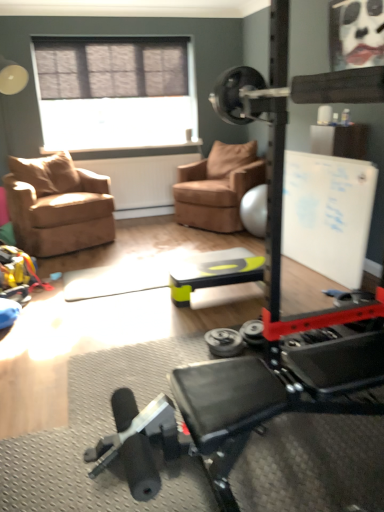
Where is `green plastic table at center`? The height and width of the screenshot is (512, 384). green plastic table at center is located at coordinates (214, 272).

This screenshot has height=512, width=384. Find the location of `white matte bulletin board at upper right`. white matte bulletin board at upper right is located at coordinates (328, 214).

Image resolution: width=384 pixels, height=512 pixels. What do you see at coordinates (361, 32) in the screenshot? I see `matte black face at upper right` at bounding box center [361, 32].

In order to face suede brown armchair at left, which appears as the second chair when viewed from the right, should I rotate leftwards or rightwards?

Turn left approximately 17.160 degrees to face it.

The height and width of the screenshot is (512, 384). I want to click on suede brown armchair at center, the first chair positioned from the right, so click(217, 187).

From the image's perspective, is matte gray window at upper center below green plastic table at center?

No.

Considering the sizes of matte gray window at upper center and green plastic table at center in the image, is matte gray window at upper center bigger or smaller than green plastic table at center?

In the image, matte gray window at upper center appears to be larger than green plastic table at center.

From a real-world perspective, is matte gray window at upper center below green plastic table at center?

No, from a real-world perspective, matte gray window at upper center is not below green plastic table at center.

Which object is thinner, matte black face at upper right or suede brown armchair at center, which is counted as the 2th chair, starting from the left?

matte black face at upper right is thinner.

From their relative heights in the image, would you say matte black face at upper right is taller or shorter than suede brown armchair at center, which is counted as the 2th chair, starting from the left?

In the image, matte black face at upper right appears to be shorter than suede brown armchair at center, which is counted as the 2th chair, starting from the left.

Between matte black face at upper right and suede brown armchair at center, the first chair positioned from the right, which one has larger size?

With larger size is suede brown armchair at center, the first chair positioned from the right.

From a real-world perspective, relative to white matte bulletin board at upper right, is suede brown armchair at left, placed as the 1th chair when sorted from left to right, vertically above or below?

suede brown armchair at left, placed as the 1th chair when sorted from left to right, is below white matte bulletin board at upper right.

Is suede brown armchair at left, placed as the 1th chair when sorted from left to right, smaller than white matte bulletin board at upper right?

No.

Choose the correct answer: Is suede brown armchair at left, placed as the 1th chair when sorted from left to right, inside white matte bulletin board at upper right or outside it?

The correct answer is: outside.

Is suede brown armchair at left, placed as the 1th chair when sorted from left to right, facing away from silver metallic dumbbell at center?

No, suede brown armchair at left, placed as the 1th chair when sorted from left to right, is not facing the opposite direction of silver metallic dumbbell at center.

From the picture: How much distance is there between suede brown armchair at left, which appears as the second chair when viewed from the right, and silver metallic dumbbell at center?

A distance of 7.71 feet exists between suede brown armchair at left, which appears as the second chair when viewed from the right, and silver metallic dumbbell at center.

Does suede brown armchair at left, placed as the 1th chair when sorted from left to right, touch silver metallic dumbbell at center?

No, suede brown armchair at left, placed as the 1th chair when sorted from left to right, is not making contact with silver metallic dumbbell at center.

Considering the relative sizes of suede brown armchair at left, placed as the 1th chair when sorted from left to right, and silver metallic dumbbell at center in the image provided, is suede brown armchair at left, placed as the 1th chair when sorted from left to right, taller than silver metallic dumbbell at center?

Indeed, suede brown armchair at left, placed as the 1th chair when sorted from left to right, has a greater height compared to silver metallic dumbbell at center.

Is point (366, 163) farther from viewer compared to point (83, 53)?

No.

Would you say matte gray window at upper center is part of white matte bulletin board at upper right's contents?

Definitely not — matte gray window at upper center is not inside white matte bulletin board at upper right.

Which object is thinner, white matte bulletin board at upper right or matte gray window at upper center?

matte gray window at upper center is thinner.

Would you consider white matte bulletin board at upper right to be distant from matte gray window at upper center?

Absolutely, white matte bulletin board at upper right is distant from matte gray window at upper center.

Which is farther from the camera, (57, 50) or (220, 335)?

Point (57, 50)

Is matte gray window at upper center oriented towards silver metallic dumbbell at center?

Yes, matte gray window at upper center faces towards silver metallic dumbbell at center.

Can silver metallic dumbbell at center be found inside matte gray window at upper center?

Actually, silver metallic dumbbell at center is outside matte gray window at upper center.

Is matte gray window at upper center not near silver metallic dumbbell at center?

Absolutely, matte gray window at upper center is distant from silver metallic dumbbell at center.

Does silver metallic dumbbell at center have a greater height compared to suede brown armchair at left, placed as the 1th chair when sorted from left to right?

No.

Find the location of a particular element. dumbbell lying below the suede brown armchair at left, which appears as the second chair when viewed from the right (from the image's perspective) is located at coordinates (224, 342).

Could you tell me if silver metallic dumbbell at center is turned towards suede brown armchair at left, which appears as the second chair when viewed from the right?

No, silver metallic dumbbell at center is not aimed at suede brown armchair at left, which appears as the second chair when viewed from the right.

Is point (229, 333) farther from viewer compared to point (61, 226)?

No, it is not.

Where is `window behind the green plastic table at center`? window behind the green plastic table at center is located at coordinates (115, 92).

What are the coordinates of `face located above the suede brown armchair at center, which is counted as the 2th chair, starting from the left (from a real-world perspective)` in the screenshot? It's located at (361, 32).

Based on their spatial positions, is silver metallic dumbbell at center or suede brown armchair at center, the first chair positioned from the right, further from matte black face at upper right?

silver metallic dumbbell at center.

From the image, which object appears to be farther from suede brown armchair at left, which appears as the second chair when viewed from the right, white matte bulletin board at upper right or green plastic table at center?

The object further to suede brown armchair at left, which appears as the second chair when viewed from the right, is white matte bulletin board at upper right.

Which object lies further to the anchor point matte gray window at upper center, green plastic table at center or suede brown armchair at center, the first chair positioned from the right?

green plastic table at center is positioned further to the anchor matte gray window at upper center.

Considering their positions, is suede brown armchair at left, placed as the 1th chair when sorted from left to right, positioned closer to green plastic table at center than silver metallic dumbbell at center?

The object closer to green plastic table at center is silver metallic dumbbell at center.

Estimate the real-world distances between objects in this image. Which object is closer to white matte bulletin board at upper right, green plastic table at center or suede brown armchair at center, the first chair positioned from the right?

green plastic table at center lies closer to white matte bulletin board at upper right than the other object.

When comparing their distances from white matte bulletin board at upper right, does suede brown armchair at left, which appears as the second chair when viewed from the right, or matte gray window at upper center seem further?

The object further to white matte bulletin board at upper right is matte gray window at upper center.

Looking at this image, estimate the real-world distances between objects in this image. Which object is closer to suede brown armchair at left, placed as the 1th chair when sorted from left to right, suede brown armchair at center, which is counted as the 2th chair, starting from the left, or matte gray window at upper center?

suede brown armchair at center, which is counted as the 2th chair, starting from the left, lies closer to suede brown armchair at left, placed as the 1th chair when sorted from left to right, than the other object.

Based on the photo, from the image, which object appears to be nearer to suede brown armchair at center, which is counted as the 2th chair, starting from the left, green plastic table at center or suede brown armchair at left, which appears as the second chair when viewed from the right?

suede brown armchair at left, which appears as the second chair when viewed from the right, is closer to suede brown armchair at center, which is counted as the 2th chair, starting from the left.

The image size is (384, 512). In order to click on chair situated between suede brown armchair at left, placed as the 1th chair when sorted from left to right, and white matte bulletin board at upper right from left to right in this screenshot , I will do `click(217, 187)`.

At what (x,y) coordinates should I click in order to perform the action: click on bulletin board between suede brown armchair at left, which appears as the second chair when viewed from the right, and matte black face at upper right from left to right. Please return your answer as a coordinate pair (x, y). The image size is (384, 512). Looking at the image, I should click on (328, 214).

Locate an element on the screen. table situated between suede brown armchair at left, which appears as the second chair when viewed from the right, and matte black face at upper right from left to right is located at coordinates (214, 272).

Where is `chair between suede brown armchair at left, which appears as the second chair when viewed from the right, and matte black face at upper right`? This screenshot has height=512, width=384. chair between suede brown armchair at left, which appears as the second chair when viewed from the right, and matte black face at upper right is located at coordinates (217, 187).